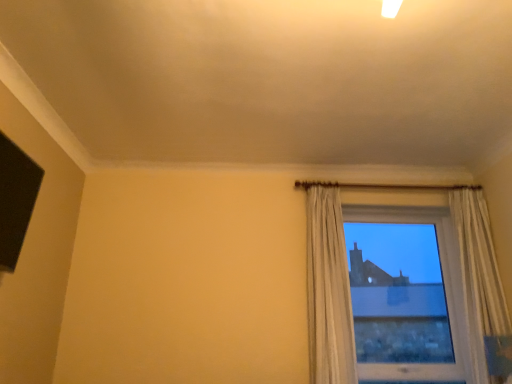
Question: Is transparent glass window at right at the back of white sheer curtain at right?

Choices:
 (A) yes
 (B) no

Answer: (B)

Question: From a real-world perspective, is white sheer curtain at right on top of transparent glass window at right?

Choices:
 (A) yes
 (B) no

Answer: (A)

Question: Is white sheer curtain at right thinner than transparent glass window at right?

Choices:
 (A) yes
 (B) no

Answer: (B)

Question: Is white sheer curtain at right to the left of transparent glass window at right from the viewer's perspective?

Choices:
 (A) yes
 (B) no

Answer: (A)

Question: Is white sheer curtain at right next to transparent glass window at right and touching it?

Choices:
 (A) no
 (B) yes

Answer: (A)

Question: Considering the relative positions of white sheer curtain at right and transparent glass window at right in the image provided, is white sheer curtain at right in front of transparent glass window at right?

Choices:
 (A) no
 (B) yes

Answer: (B)

Question: Could white sheer curtain at right be considered to be inside transparent glass window at right?

Choices:
 (A) no
 (B) yes

Answer: (A)

Question: Considering the relative sizes of transparent glass window at right and white sheer curtain at right in the image provided, is transparent glass window at right shorter than white sheer curtain at right?

Choices:
 (A) yes
 (B) no

Answer: (A)

Question: Is transparent glass window at right smaller than white sheer curtain at right?

Choices:
 (A) no
 (B) yes

Answer: (A)

Question: Does transparent glass window at right have a greater width compared to white sheer curtain at right?

Choices:
 (A) yes
 (B) no

Answer: (B)

Question: Is transparent glass window at right taller than white sheer curtain at right?

Choices:
 (A) no
 (B) yes

Answer: (A)

Question: Is transparent glass window at right not within white sheer curtain at right?

Choices:
 (A) no
 (B) yes

Answer: (B)

Question: In the image, is transparent glass window at right on the left side or the right side of white sheer curtain at right?

Choices:
 (A) left
 (B) right

Answer: (B)